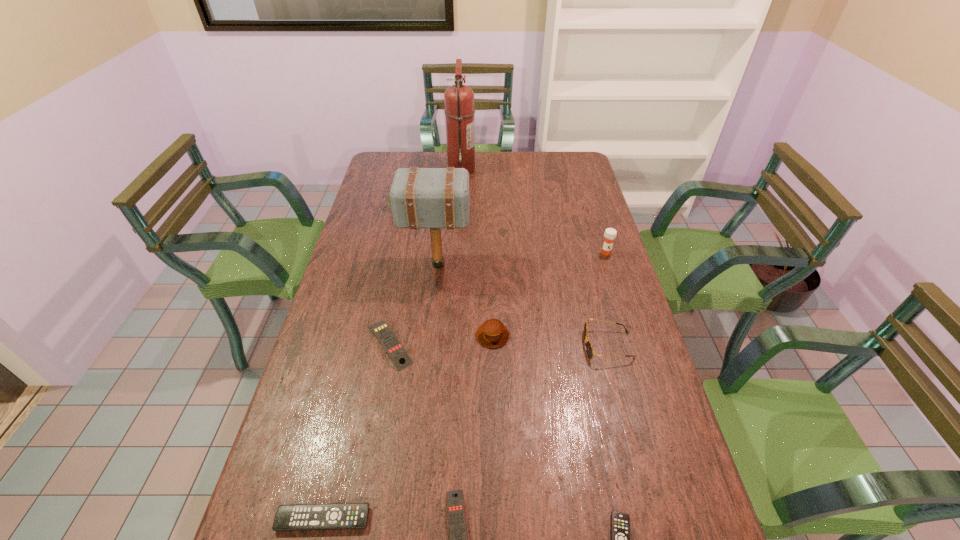
Locate an element on the screen. The height and width of the screenshot is (540, 960). the farthest object is located at coordinates (459, 111).

Where is `fire extinguisher`? The height and width of the screenshot is (540, 960). fire extinguisher is located at coordinates (459, 111).

The height and width of the screenshot is (540, 960). In order to click on the ninth shortest object in this screenshot , I will do `click(435, 198)`.

You are a GUI agent. You are given a task and a screenshot of the screen. Output one action in this format:
    pyautogui.click(x=<x>, y=<y>)
    Task: Click on the mallet
    Image resolution: width=960 pixels, height=540 pixels.
    Given the screenshot: What is the action you would take?
    pyautogui.click(x=435, y=198)

I want to click on the second farthest object, so click(389, 197).

Where is `avocado`? avocado is located at coordinates (389, 197).

Where is `medicine`? The height and width of the screenshot is (540, 960). medicine is located at coordinates (610, 234).

You are a GUI agent. You are given a task and a screenshot of the screen. Output one action in this format:
    pyautogui.click(x=<x>, y=<y>)
    Task: Click on the fourth object from right to left
    This screenshot has height=540, width=960.
    Given the screenshot: What is the action you would take?
    pyautogui.click(x=492, y=333)

Locate an element on the screen. Image resolution: width=960 pixels, height=540 pixels. the sixth shortest object is located at coordinates (492, 333).

In order to click on sunglasses in this screenshot , I will do `click(589, 348)`.